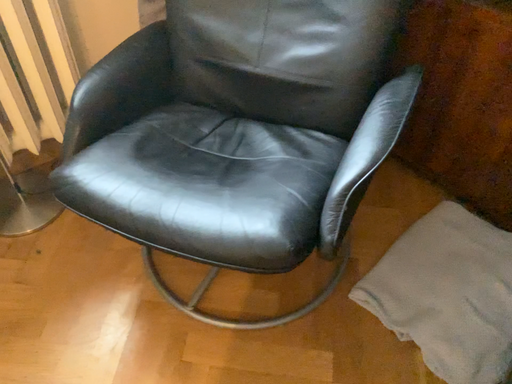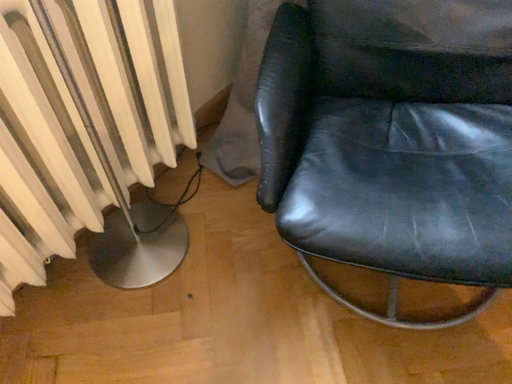
Question: How did the camera likely rotate when shooting the video?

Choices:
 (A) rotated left
 (B) rotated right

Answer: (B)